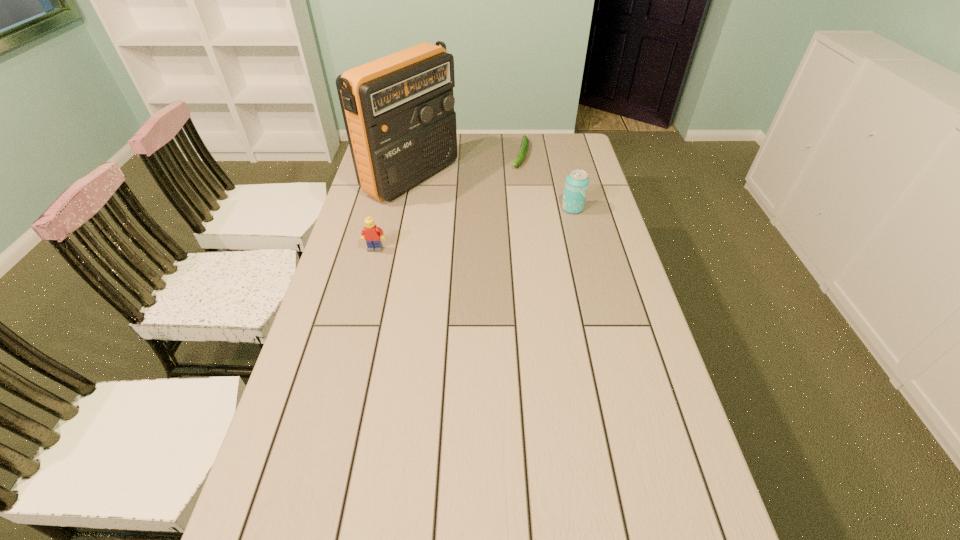
Identify the location of free space on the desktop that is between the Lego and the beer can and is positioned on the front-facing side of the shortest object. The width and height of the screenshot is (960, 540). (495, 224).

The image size is (960, 540). Identify the location of vacant spot on the desktop that is between the nearest object and the rightmost object and is positioned on the front-facing side of the radio receiver. (504, 222).